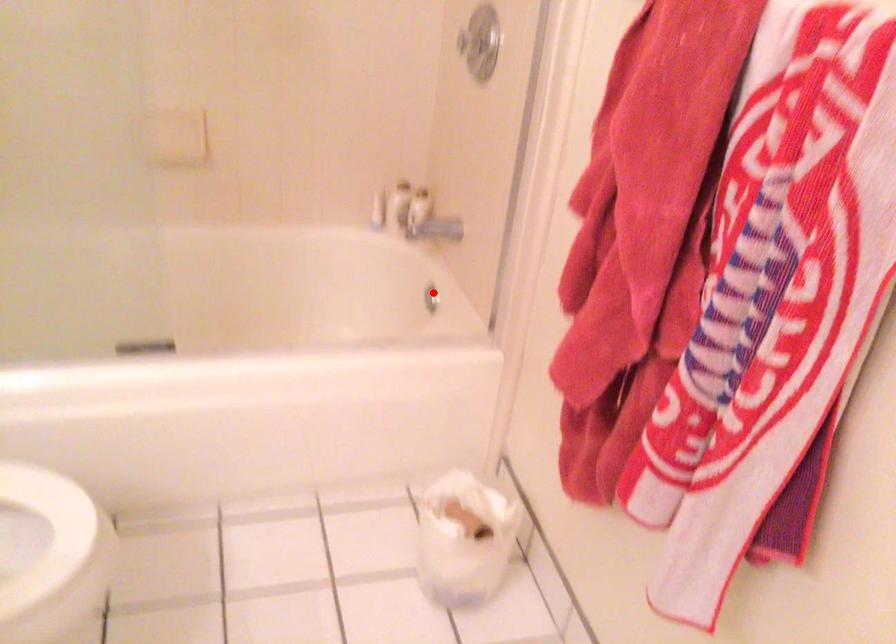
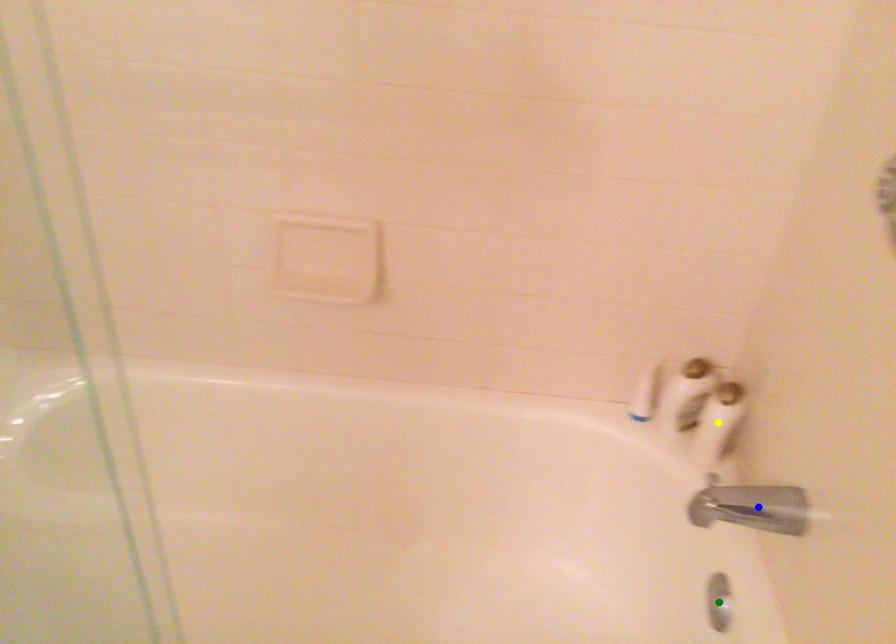
Question: I am providing you with two images of the same scene from different viewpoints. A red point is marked on the first image. You are given multiple points on the second image. Which mark in image 2 goes with the point in image 1?

Choices:
 (A) yellow point
 (B) blue point
 (C) green point

Answer: (C)